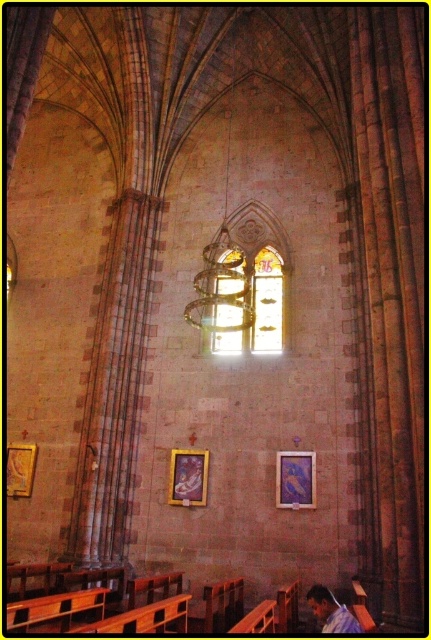
Consider the image. You are standing in the center of the nave of the historic church. You see a point marked at coordinates point [296,480]. What object is located at this point?

The point [296,480] corresponds to the location of the matte gold picture frame at center.